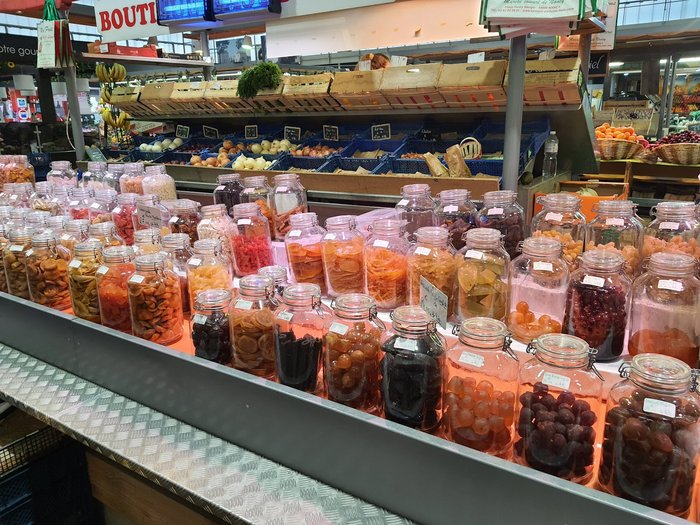
Locate an element on the screen. window is located at coordinates (13, 141).